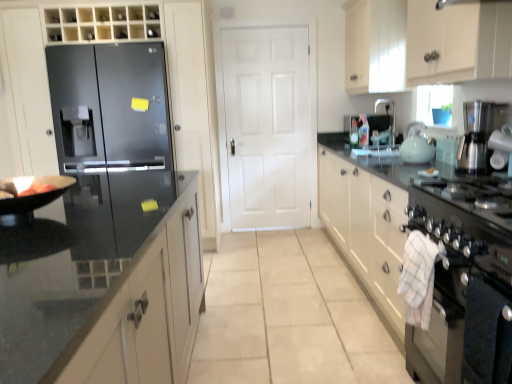
Question: Would you say white glossy cabinet at upper right, which ranks as the 2th cabinetry in right-to-left order, is part of glossy black refrigerator at left, the 3th cabinetry when ordered from right to left,'s contents?

Choices:
 (A) no
 (B) yes

Answer: (A)

Question: From the image's perspective, is glossy black refrigerator at left, which is counted as the 1th cabinetry, starting from the left, under white glossy cabinet at upper right, positioned as the second cabinetry in left-to-right order?

Choices:
 (A) yes
 (B) no

Answer: (A)

Question: Is glossy black refrigerator at left, which is counted as the 1th cabinetry, starting from the left, turned away from white glossy cabinet at upper right, positioned as the second cabinetry in left-to-right order?

Choices:
 (A) no
 (B) yes

Answer: (A)

Question: From the image's perspective, would you say glossy black refrigerator at left, the 3th cabinetry when ordered from right to left, is positioned over white glossy cabinet at upper right, which ranks as the 2th cabinetry in right-to-left order?

Choices:
 (A) no
 (B) yes

Answer: (A)

Question: Is glossy black refrigerator at left, the 3th cabinetry when ordered from right to left, to the left of white glossy cabinet at upper right, which ranks as the 2th cabinetry in right-to-left order, from the viewer's perspective?

Choices:
 (A) yes
 (B) no

Answer: (A)

Question: Considering the relative sizes of glossy black refrigerator at left, the 3th cabinetry when ordered from right to left, and white glossy cabinet at upper right, positioned as the second cabinetry in left-to-right order, in the image provided, is glossy black refrigerator at left, the 3th cabinetry when ordered from right to left, shorter than white glossy cabinet at upper right, positioned as the second cabinetry in left-to-right order,?

Choices:
 (A) yes
 (B) no

Answer: (B)

Question: Does glossy black refrigerator at left, the 3th cabinetry when ordered from right to left, turn towards satin black refrigerator at left?

Choices:
 (A) yes
 (B) no

Answer: (A)

Question: From the image's perspective, is glossy black refrigerator at left, which is counted as the 1th cabinetry, starting from the left, beneath satin black refrigerator at left?

Choices:
 (A) no
 (B) yes

Answer: (A)

Question: Are glossy black refrigerator at left, which is counted as the 1th cabinetry, starting from the left, and satin black refrigerator at left making contact?

Choices:
 (A) yes
 (B) no

Answer: (A)

Question: Can you confirm if glossy black refrigerator at left, which is counted as the 1th cabinetry, starting from the left, is bigger than satin black refrigerator at left?

Choices:
 (A) yes
 (B) no

Answer: (A)

Question: Is glossy black refrigerator at left, which is counted as the 1th cabinetry, starting from the left, taller than satin black refrigerator at left?

Choices:
 (A) no
 (B) yes

Answer: (B)

Question: Considering the relative positions of glossy black refrigerator at left, which is counted as the 1th cabinetry, starting from the left, and satin black refrigerator at left in the image provided, is glossy black refrigerator at left, which is counted as the 1th cabinetry, starting from the left, behind satin black refrigerator at left?

Choices:
 (A) no
 (B) yes

Answer: (B)

Question: Is white matte door at center oriented away from white glossy cabinet at upper right, which ranks as the 2th cabinetry in right-to-left order?

Choices:
 (A) no
 (B) yes

Answer: (A)